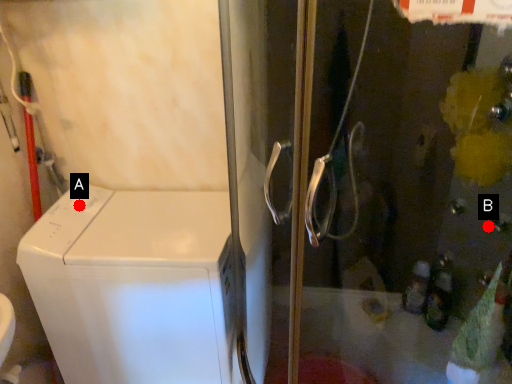
Question: Two points are circled on the image, labeled by A and B beside each circle. Among these points, which one is nearest to the camera?

Choices:
 (A) A is closer
 (B) B is closer

Answer: (B)